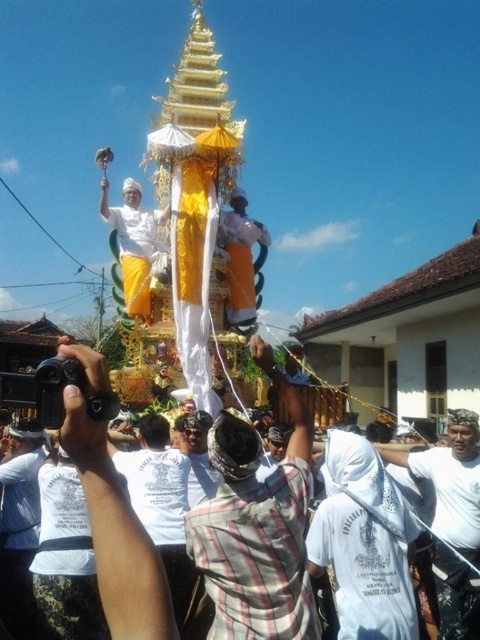
Question: Does plaid shirt at center have a larger size compared to white woven cloth at center?

Choices:
 (A) no
 (B) yes

Answer: (B)

Question: Can you confirm if plaid shirt at center is wider than white woven cloth at center?

Choices:
 (A) no
 (B) yes

Answer: (B)

Question: Which point is closer to the camera?

Choices:
 (A) plaid shirt at center
 (B) white woven cloth at center

Answer: (A)

Question: Does plaid shirt at center have a lesser width compared to white woven cloth at center?

Choices:
 (A) yes
 (B) no

Answer: (B)